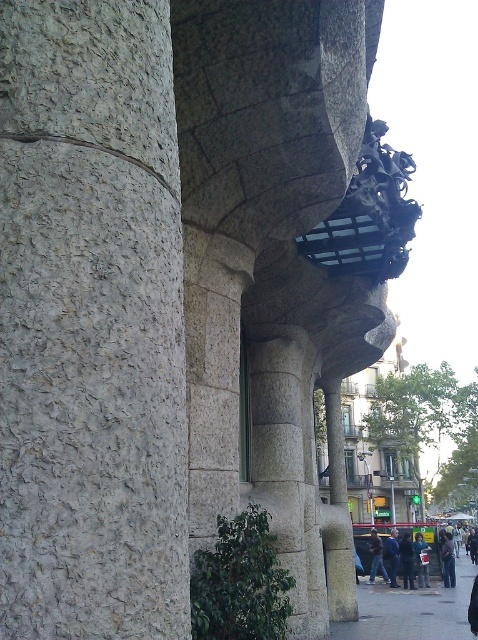
Question: Is gray rough stone column at left below dark blue jeans at center?

Choices:
 (A) no
 (B) yes

Answer: (A)

Question: Estimate the real-world distances between objects in this image. Which object is farther from the dark blue jacket at lower right?

Choices:
 (A) dark blue jeans at lower right
 (B) dark blue jeans at center
 (C) concrete pavement at lower right
 (D) dark blue jeans at lower center

Answer: (C)

Question: Among these points, which one is nearest to the camera?

Choices:
 (A) (369, 547)
 (B) (424, 566)
 (C) (105, 196)

Answer: (C)

Question: Among these points, which one is nearest to the camera?

Choices:
 (A) (405, 548)
 (B) (372, 561)
 (C) (419, 545)

Answer: (A)

Question: Is gray rough stone column at left bigger than dark blue jeans at lower center?

Choices:
 (A) yes
 (B) no

Answer: (B)

Question: Can you confirm if dark blue jeans at lower right is thinner than dark blue jacket at center?

Choices:
 (A) yes
 (B) no

Answer: (B)